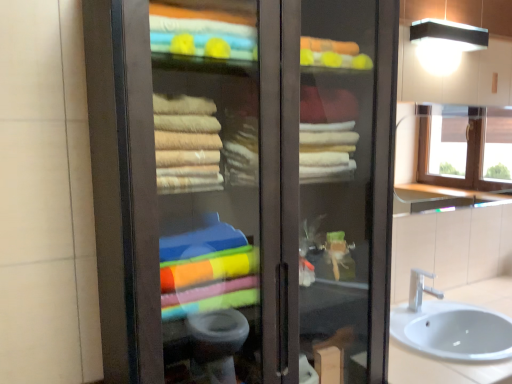
Where is `blank space above black matte light fixture at upper right (from a real-world perspective)`? blank space above black matte light fixture at upper right (from a real-world perspective) is located at coordinates (453, 26).